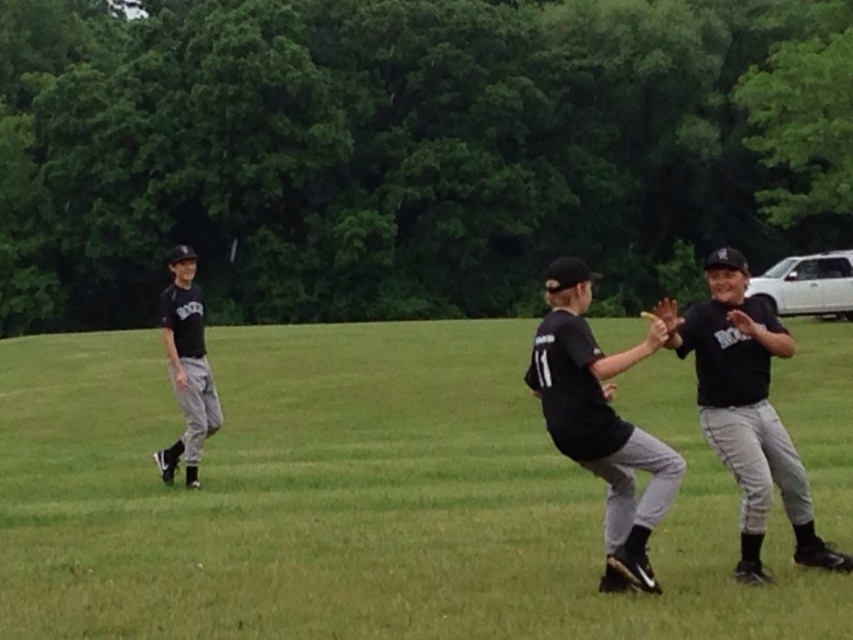
Is green grass at center positioned at the back of black matte baseball glove at center?

That is False.

Who is lower down, green grass at center or black matte baseball glove at center?

green grass at center is below.

Which is behind, point (567, 589) or point (590, 384)?

Point (567, 589)

Find the location of a particular element. The image size is (853, 640). green grass at center is located at coordinates (357, 497).

Is black matte baseball cap at upper right below black matte uniform at left?

Indeed, black matte baseball cap at upper right is positioned under black matte uniform at left.

Is point (750, 564) farther from camera compared to point (189, 294)?

No, it is not.

What are the coordinates of `black matte baseball cap at upper right` in the screenshot? It's located at (746, 408).

Between green grass at center and black matte uniform at left, which one is positioned higher?

black matte uniform at left is above.

Who is more forward, (x=265, y=342) or (x=186, y=321)?

Point (x=186, y=321) is in front.

Image resolution: width=853 pixels, height=640 pixels. Find the location of `green grass at center`. green grass at center is located at coordinates (357, 497).

Where is `green grass at center`? This screenshot has height=640, width=853. green grass at center is located at coordinates [x=357, y=497].